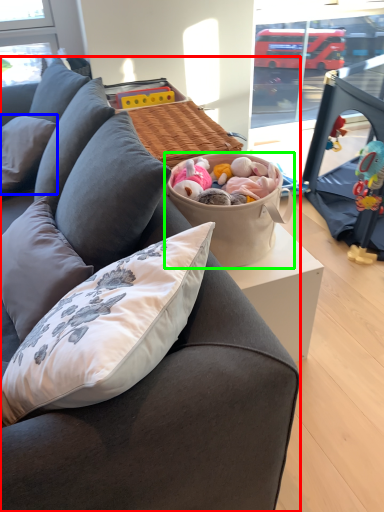
Question: Considering the real-world distances, which object is closest to studio couch (highlighted by a red box)? pillow (highlighted by a blue box) or picnic basket (highlighted by a green box).

Choices:
 (A) pillow
 (B) picnic basket

Answer: (B)